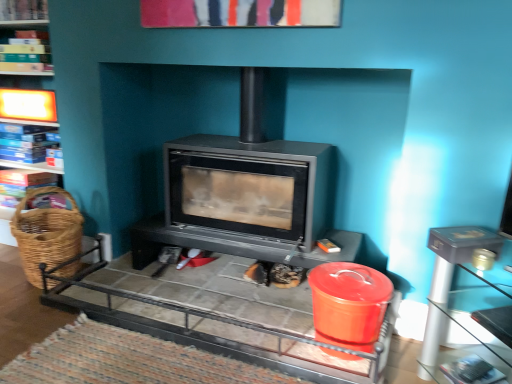
Question: Is wooden bookshelf at upper left, which is the second shelf in bottom-to-top order, at the right side of blue cardboard boxes at left, which is counted as the 1th shelf, starting from the bottom?

Choices:
 (A) yes
 (B) no

Answer: (A)

Question: Considering the relative positions of wooden bookshelf at upper left, which is the second shelf in bottom-to-top order, and blue cardboard boxes at left, which is counted as the 1th shelf, starting from the bottom, in the image provided, is wooden bookshelf at upper left, which is the second shelf in bottom-to-top order, behind blue cardboard boxes at left, which is counted as the 1th shelf, starting from the bottom,?

Choices:
 (A) no
 (B) yes

Answer: (A)

Question: Is wooden bookshelf at upper left, which ranks as the 2th shelf in top-to-bottom order, to the left of blue cardboard boxes at left, which is the third shelf from top to bottom, from the viewer's perspective?

Choices:
 (A) yes
 (B) no

Answer: (B)

Question: From a real-world perspective, is wooden bookshelf at upper left, which is the second shelf in bottom-to-top order, under blue cardboard boxes at left, which is the third shelf from top to bottom?

Choices:
 (A) yes
 (B) no

Answer: (B)

Question: Does wooden bookshelf at upper left, which ranks as the 2th shelf in top-to-bottom order, have a greater height compared to blue cardboard boxes at left, which is counted as the 1th shelf, starting from the bottom?

Choices:
 (A) yes
 (B) no

Answer: (B)

Question: Can you confirm if wooden bookshelf at upper left, which ranks as the 2th shelf in top-to-bottom order, is smaller than blue cardboard boxes at left, which is counted as the 1th shelf, starting from the bottom?

Choices:
 (A) yes
 (B) no

Answer: (B)

Question: From a real-world perspective, does wooden bookshelf at upper left, which is the second shelf in bottom-to-top order, stand above metallic gray table at right, acting as the 1th table starting from the right?

Choices:
 (A) no
 (B) yes

Answer: (B)

Question: Does wooden bookshelf at upper left, which ranks as the 2th shelf in top-to-bottom order, have a lesser width compared to metallic gray table at right, arranged as the second table when viewed from the left?

Choices:
 (A) no
 (B) yes

Answer: (B)

Question: Can you confirm if wooden bookshelf at upper left, which ranks as the 2th shelf in top-to-bottom order, is shorter than metallic gray table at right, acting as the 1th table starting from the right?

Choices:
 (A) no
 (B) yes

Answer: (B)

Question: From a real-world perspective, does wooden bookshelf at upper left, which ranks as the 2th shelf in top-to-bottom order, sit lower than metallic gray table at right, acting as the 1th table starting from the right?

Choices:
 (A) no
 (B) yes

Answer: (A)

Question: From the image's perspective, is wooden bookshelf at upper left, which ranks as the 2th shelf in top-to-bottom order, on metallic gray table at right, arranged as the second table when viewed from the left?

Choices:
 (A) yes
 (B) no

Answer: (A)

Question: Is metallic gray table at right, acting as the 1th table starting from the right, inside wooden bookshelf at upper left, which ranks as the 2th shelf in top-to-bottom order?

Choices:
 (A) yes
 (B) no

Answer: (B)

Question: Considering the relative sizes of wooden bookshelf at upper left, which is the second shelf in bottom-to-top order, and wooden bookshelf at upper left, which is the third shelf in bottom-to-top order, in the image provided, is wooden bookshelf at upper left, which is the second shelf in bottom-to-top order, bigger than wooden bookshelf at upper left, which is the third shelf in bottom-to-top order,?

Choices:
 (A) yes
 (B) no

Answer: (A)